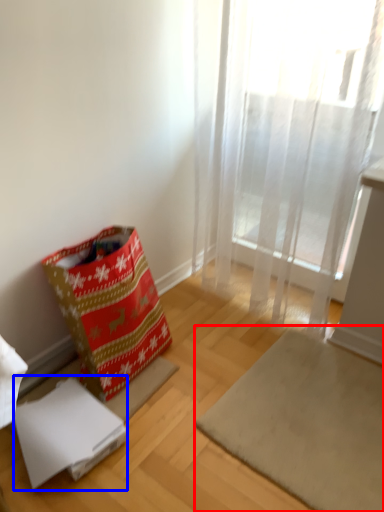
Question: Among these objects, which one is nearest to the camera, mat (highlighted by a red box) or cardboard box (highlighted by a blue box)?

Choices:
 (A) mat
 (B) cardboard box

Answer: (A)